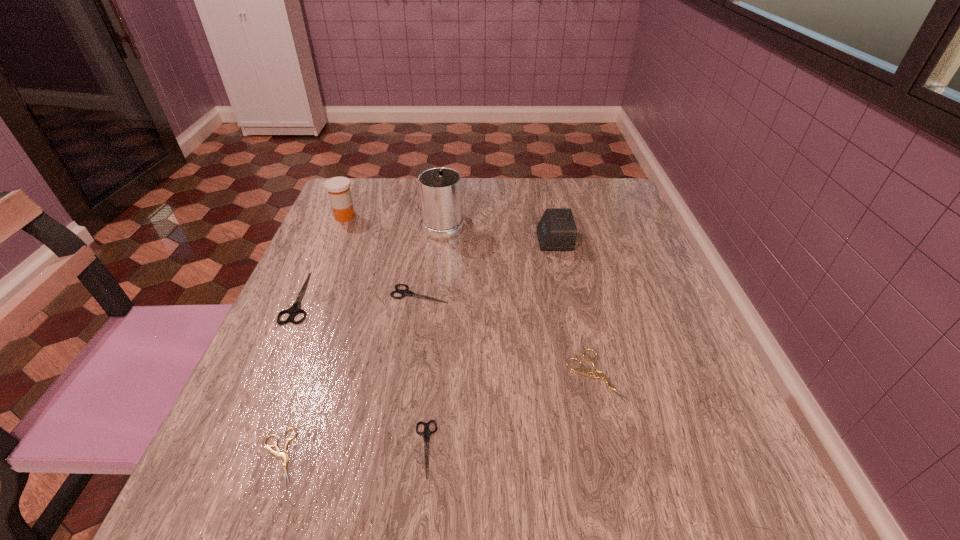
This screenshot has height=540, width=960. Find the location of `free spot between the leftmost shears and the gray mug`. free spot between the leftmost shears and the gray mug is located at coordinates (372, 260).

This screenshot has height=540, width=960. I want to click on vacant space that is in between the second smallest black shears and the third nearest object, so click(508, 335).

Identify the location of free space between the tallest shears and the nearest black shears. (363, 373).

Identify the location of vacant region between the second tallest object and the second tallest shears. (382, 255).

At what (x,y) coordinates should I click in order to perform the action: click on free space between the nearest black shears and the alarm clock. Please return your answer as a coordinate pair (x, y). Image resolution: width=960 pixels, height=540 pixels. Looking at the image, I should click on (490, 345).

Where is `blank region between the fifth tallest object and the nearer beige shears`? blank region between the fifth tallest object and the nearer beige shears is located at coordinates (349, 375).

Find the location of a particular element. The height and width of the screenshot is (540, 960). object that is the closest one to the second tallest shears is located at coordinates (294, 310).

Choose which object is the fifth nearest neighbor to the farther beige shears. Please provide its 2D coordinates. Your answer should be formatted as a tuple, i.e. [(x, y)], where the tuple contains the x and y coordinates of a point satisfying the conditions above.

[(285, 456)]

You are a GUI agent. You are given a task and a screenshot of the screen. Output one action in this format:
    pyautogui.click(x=<x>, y=<y>)
    Task: Click on the closest shears to the third nearest object
    
    Given the screenshot: What is the action you would take?
    pyautogui.click(x=426, y=433)

This screenshot has width=960, height=540. I want to click on shears object that ranks as the third closest to the orange medicine, so click(x=285, y=456).